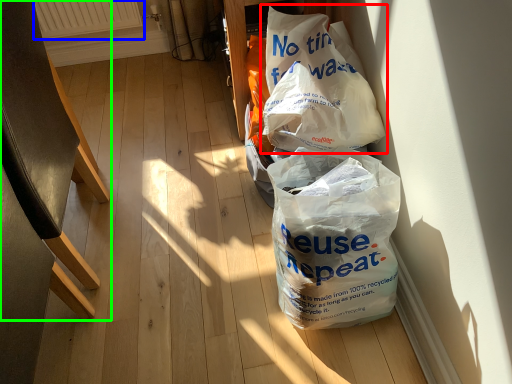
Question: Which is nearer to the plastic bag (highlighted by a red box)? radiator (highlighted by a blue box) or furniture (highlighted by a green box).

Choices:
 (A) radiator
 (B) furniture

Answer: (B)